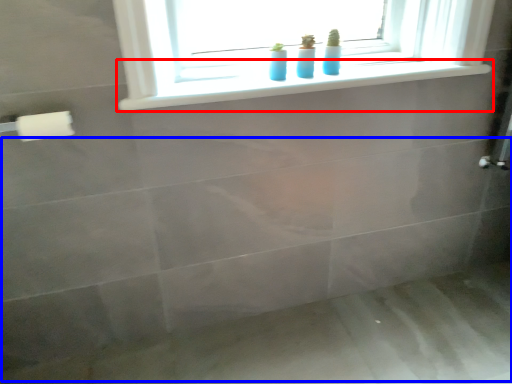
Question: Among these objects, which one is nearest to the camera, window sill (highlighted by a red box) or bath (highlighted by a blue box)?

Choices:
 (A) window sill
 (B) bath

Answer: (B)